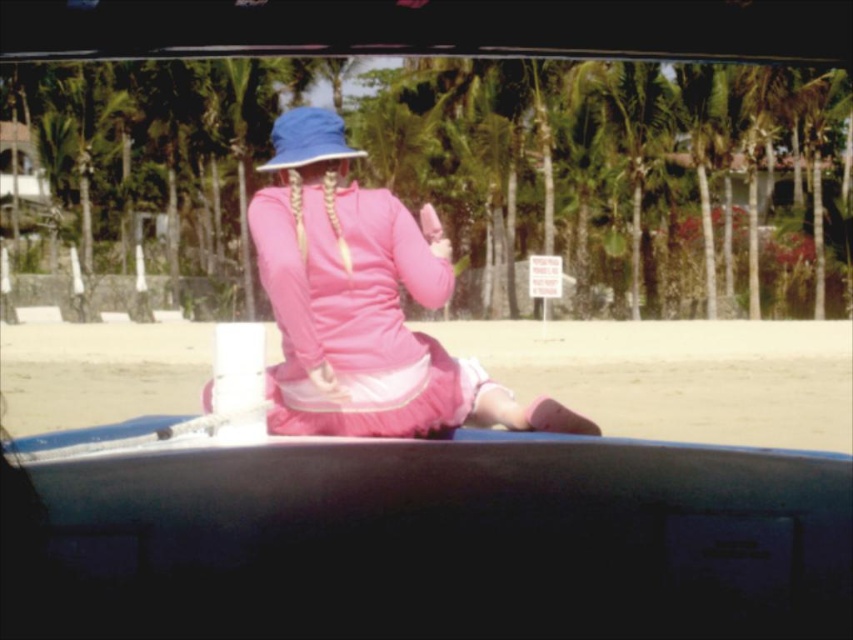
You are a photographer trying to capture a photo of the blue plastic canoe at center and the pink fabric skirt at center from the driver seat of the vehicle. Based on the scene, which object is located to the right of the other?

The blue plastic canoe at center is positioned on the right side of pink fabric skirt at center, so the blue plastic canoe at center is to the right of the pink fabric skirt at center.

You are a photographer trying to capture a photo of the blue plastic canoe at center and the pink fabric skirt at center from the vehicle. Since the window frame is dark and tinted, you need to ensure both objects are fully visible. Which object might be more challenging to see clearly due to its height?

The blue plastic canoe at center has a lesser height compared to the pink fabric skirt at center, so the blue plastic canoe at center might be more challenging to see clearly because it is shorter and could be partially obscured by the window frame.

From the picture: You are a photographer inside a car with a tinted window. You want to capture the girl in the pink outfit on the beach through the window. The pink matte dress at center is exactly at point (x=363, y=305). If your camera can only focus on objects within a 0.1 radius around the center point, will the girl in the pink outfit be in focus?

The pink matte dress at center is exactly at point (x=363, y=305), which is within the 0.1 radius around the center point. Therefore, the girl in the pink outfit will be in focus.